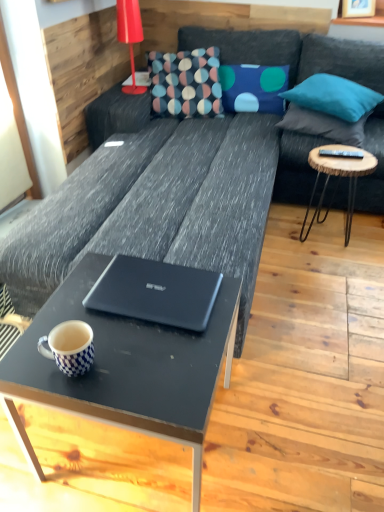
Question: From their relative heights in the image, would you say matte black coffee table at center is taller or shorter than teal fabric pillow at upper right, positioned as the 3th pillow in left-to-right order?

Choices:
 (A) tall
 (B) short

Answer: (A)

Question: Would you say matte black coffee table at center is to the left or to the right of teal fabric pillow at upper right, positioned as the 3th pillow in left-to-right order, in the picture?

Choices:
 (A) right
 (B) left

Answer: (B)

Question: Considering the real-world distances, which object is farthest from the matte black coffee table at center?

Choices:
 (A) teal fabric pillow at upper right, positioned as the 3th pillow in left-to-right order
 (B) black plastic remote at right
 (C) matte red lamp at upper left
 (D) matte black laptop at center
 (E) wooden round side table at right

Answer: (C)

Question: Based on their relative distances, which object is nearer to the blue fabric pillow at upper right, which is counted as the third pillow, starting from the right?

Choices:
 (A) black plastic remote at right
 (B) matte red lamp at upper left
 (C) teal fabric pillow at upper right, the second pillow viewed from the right
 (D) matte black coffee table at center
 (E) matte black laptop at center

Answer: (C)